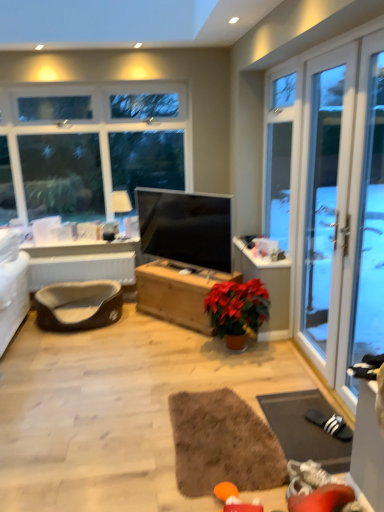
At what (x,y) coordinates should I click in order to perform the action: click on wooden chest at center. Please return your answer as a coordinate pair (x, y). Image resolution: width=384 pixels, height=512 pixels. Looking at the image, I should click on (178, 292).

At what (x,y) coordinates should I click in order to perform the action: click on brown shaggy rug at center, the second yoga mat viewed from the right. Please return your answer as a coordinate pair (x, y). This screenshot has height=512, width=384. Looking at the image, I should click on (223, 444).

What is the approximate height of dark gray rubber yoga mat at lower right, the first yoga mat viewed from the right?

2.52 inches.

Identify the location of transparent glass screen door at right. The width and height of the screenshot is (384, 512). (343, 211).

Can you tell me how much brown shaggy rug at center, the second yoga mat viewed from the right, and matte black tv at center differ in facing direction?

The angular difference between brown shaggy rug at center, the second yoga mat viewed from the right, and matte black tv at center is 42.2 degrees.

Consider the image. Is brown shaggy rug at center, which appears as the first yoga mat when viewed from the left, closer to the viewer compared to matte black tv at center?

Yes, brown shaggy rug at center, which appears as the first yoga mat when viewed from the left, is in front of matte black tv at center.

Considering the relative sizes of brown shaggy rug at center, the second yoga mat viewed from the right, and matte black tv at center in the image provided, is brown shaggy rug at center, the second yoga mat viewed from the right, wider than matte black tv at center?

Yes, brown shaggy rug at center, the second yoga mat viewed from the right, is wider than matte black tv at center.

Which is more to the left, brown shaggy rug at center, which appears as the first yoga mat when viewed from the left, or matte black tv at center?

Positioned to the left is matte black tv at center.

Is the depth of brown shaggy rug at center, the second yoga mat viewed from the right, less than that of wooden chest at center?

Yes, brown shaggy rug at center, the second yoga mat viewed from the right, is in front of wooden chest at center.

Find the location of `desk above the brown shaggy rug at center, the second yoga mat viewed from the right (from a real-world perspective)`. desk above the brown shaggy rug at center, the second yoga mat viewed from the right (from a real-world perspective) is located at coordinates (178, 292).

From a real-world perspective, is brown shaggy rug at center, which appears as the first yoga mat when viewed from the left, above or below wooden chest at center?

brown shaggy rug at center, which appears as the first yoga mat when viewed from the left, is situated lower than wooden chest at center in the real world.

Does brown shaggy rug at center, which appears as the first yoga mat when viewed from the left, appear on the right side of wooden chest at center?

Indeed, brown shaggy rug at center, which appears as the first yoga mat when viewed from the left, is positioned on the right side of wooden chest at center.

Could you measure the distance between dark gray rubber yoga mat at lower right, the first yoga mat viewed from the right, and matte white lampshade at upper left?

They are 2.54 meters apart.

From the image's perspective, which is above, dark gray rubber yoga mat at lower right, which appears as the second yoga mat when viewed from the left, or matte white lampshade at upper left?

matte white lampshade at upper left appears higher in the image.

Looking at this image, can we say dark gray rubber yoga mat at lower right, the first yoga mat viewed from the right, lies outside matte white lampshade at upper left?

dark gray rubber yoga mat at lower right, the first yoga mat viewed from the right, lies outside matte white lampshade at upper left's area.

At what (x,y) coordinates should I click in order to perform the action: click on desk below the matte black tv at center (from a real-world perspective). Please return your answer as a coordinate pair (x, y). The image size is (384, 512). Looking at the image, I should click on click(x=178, y=292).

Is there a large distance between matte black tv at center and wooden chest at center?

matte black tv at center is actually quite close to wooden chest at center.

Is point (222, 209) closer or farther from the camera than point (180, 294)?

Clearly, point (222, 209) is closer to the camera than point (180, 294).

How many degrees apart are the facing directions of matte black tv at center and wooden chest at center?

matte black tv at center and wooden chest at center are facing 0.54 degrees away from each other.

Can you confirm if brown shaggy rug at center, which appears as the first yoga mat when viewed from the left, is wider than matte white lampshade at upper left?

Correct, the width of brown shaggy rug at center, which appears as the first yoga mat when viewed from the left, exceeds that of matte white lampshade at upper left.

Between brown shaggy rug at center, which appears as the first yoga mat when viewed from the left, and matte white lampshade at upper left, which one has less height?

brown shaggy rug at center, which appears as the first yoga mat when viewed from the left.

Is brown shaggy rug at center, the second yoga mat viewed from the right, facing away from matte white lampshade at upper left?

No, brown shaggy rug at center, the second yoga mat viewed from the right, is not facing away from matte white lampshade at upper left.

Is matte white lampshade at upper left inside brown shaggy rug at center, which appears as the first yoga mat when viewed from the left?

No, matte white lampshade at upper left is not a part of brown shaggy rug at center, which appears as the first yoga mat when viewed from the left.

Is brown plush pet bed at lower left turned away from wooden chest at center?

No, wooden chest at center is not at the back of brown plush pet bed at lower left.

Can you confirm if brown plush pet bed at lower left is positioned to the right of wooden chest at center?

In fact, brown plush pet bed at lower left is to the left of wooden chest at center.

Is brown plush pet bed at lower left completely or partially outside of wooden chest at center?

Yes, brown plush pet bed at lower left is outside of wooden chest at center.

Is brown plush pet bed at lower left positioned far away from wooden chest at center?

No.

From the image's perspective, which is below, matte brown wooden chest at center or matte black tv at center?

matte brown wooden chest at center appears lower in the image.

Is matte brown wooden chest at center wider than matte black tv at center?

No, matte brown wooden chest at center is not wider than matte black tv at center.

Is matte brown wooden chest at center positioned with its back to matte black tv at center?

Yes, matte black tv at center is at the back of matte brown wooden chest at center.

Which is behind, matte brown wooden chest at center or matte black tv at center?

Positioned behind is matte brown wooden chest at center.

In the image, there is a brown shaggy rug at center, which appears as the first yoga mat when viewed from the left. Identify the location of television above it (from the image's perspective). coord(185,228).

Locate an element on the screen. This screenshot has width=384, height=512. desk above the brown shaggy rug at center, which appears as the first yoga mat when viewed from the left (from a real-world perspective) is located at coordinates (178, 292).

Which object lies nearer to the anchor point matte white lampshade at upper left, brown plush pet bed at lower left or wooden chest at center?

The object closer to matte white lampshade at upper left is brown plush pet bed at lower left.

From the image, which object appears to be nearer to wooden chest at center, matte brown wooden chest at center or matte white lampshade at upper left?

Based on the image, matte brown wooden chest at center appears to be nearer to wooden chest at center.

When comparing their distances from matte white lampshade at upper left, does brown plush pet bed at lower left or dark gray rubber yoga mat at lower right, which appears as the second yoga mat when viewed from the left, seem further?

dark gray rubber yoga mat at lower right, which appears as the second yoga mat when viewed from the left.

Estimate the real-world distances between objects in this image. Which object is further from brown plush pet bed at lower left, wooden chest at center or brown shaggy rug at center, which appears as the first yoga mat when viewed from the left?

Among the two, brown shaggy rug at center, which appears as the first yoga mat when viewed from the left, is located further to brown plush pet bed at lower left.

Looking at the image, which one is located further to matte black tv at center, dark gray rubber yoga mat at lower right, which appears as the second yoga mat when viewed from the left, or wooden chest at center?

The object further to matte black tv at center is dark gray rubber yoga mat at lower right, which appears as the second yoga mat when viewed from the left.

Looking at the image, which one is located closer to brown plush pet bed at lower left, dark gray rubber yoga mat at lower right, the first yoga mat viewed from the right, or matte brown wooden chest at center?

matte brown wooden chest at center is closer to brown plush pet bed at lower left.

Which object lies nearer to the anchor point matte white lampshade at upper left, brown fabric pet bed at lower left or dark gray rubber yoga mat at lower right, the first yoga mat viewed from the right?

brown fabric pet bed at lower left is positioned closer to the anchor matte white lampshade at upper left.

When comparing their distances from matte black tv at center, does transparent glass screen door at right or brown shaggy rug at center, which appears as the first yoga mat when viewed from the left, seem closer?

transparent glass screen door at right is closer to matte black tv at center.

This screenshot has height=512, width=384. What are the coordinates of `table positioned between dark gray rubber yoga mat at lower right, the first yoga mat viewed from the right, and matte white lampshade at upper left from near to far` in the screenshot? It's located at tap(82, 261).

The image size is (384, 512). I want to click on television between brown shaggy rug at center, the second yoga mat viewed from the right, and matte brown wooden chest at center from front to back, so click(x=185, y=228).

Where is `television positioned between brown shaggy rug at center, which appears as the first yoga mat when viewed from the left, and wooden chest at center from near to far`? television positioned between brown shaggy rug at center, which appears as the first yoga mat when viewed from the left, and wooden chest at center from near to far is located at coordinates (185, 228).

Locate an element on the screen. The width and height of the screenshot is (384, 512). pillow located between dark gray rubber yoga mat at lower right, which appears as the second yoga mat when viewed from the left, and matte white lampshade at upper left in the depth direction is located at coordinates (79, 305).